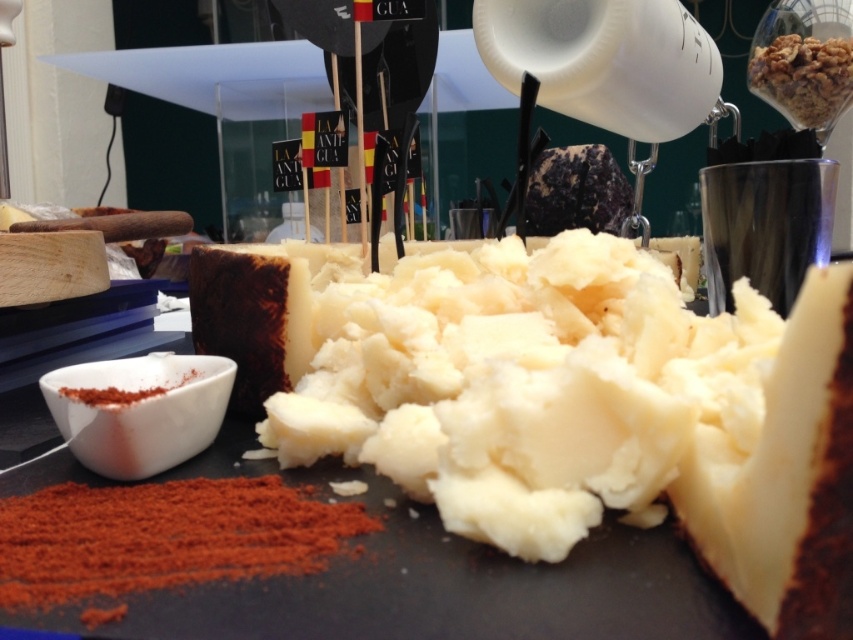
Locate an element on the screen. Image resolution: width=853 pixels, height=640 pixels. crumbly brown nuts at upper right is located at coordinates (804, 77).

Is crumbly brown nuts at upper right positioned before red powder at lower left?

No.

Is point (817, 129) behind point (142, 394)?

Yes, it is.

You are a GUI agent. You are given a task and a screenshot of the screen. Output one action in this format:
    pyautogui.click(x=<x>, y=<y>)
    Task: Click on the crumbly brown nuts at upper right
    This screenshot has width=853, height=640.
    Given the screenshot: What is the action you would take?
    pyautogui.click(x=804, y=77)

In the scene shown: Which is above, white creamy cheese at center or crumbly brown nuts at upper right?

crumbly brown nuts at upper right

Who is positioned more to the left, white creamy cheese at center or crumbly brown nuts at upper right?

Positioned to the left is white creamy cheese at center.

Which is behind, point (653, 298) or point (775, 40)?

Positioned behind is point (775, 40).

At what (x,y) coordinates should I click in order to perform the action: click on white creamy cheese at center. Please return your answer as a coordinate pair (x, y). Looking at the image, I should click on (524, 385).

Between white creamy cheese at center and red powder at lower left, which one appears on the right side from the viewer's perspective?

From the viewer's perspective, white creamy cheese at center appears more on the right side.

Is point (347, 451) more distant than point (99, 401)?

Yes, point (347, 451) is farther from viewer.

Locate an element on the screen. white creamy cheese at center is located at coordinates (524, 385).